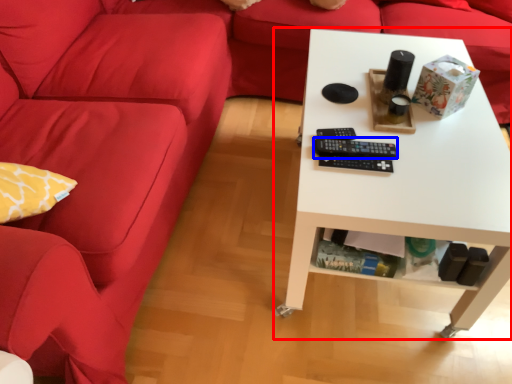
Question: Among these objects, which one is nearest to the camera, table (highlighted by a red box) or control (highlighted by a blue box)?

Choices:
 (A) table
 (B) control

Answer: (A)